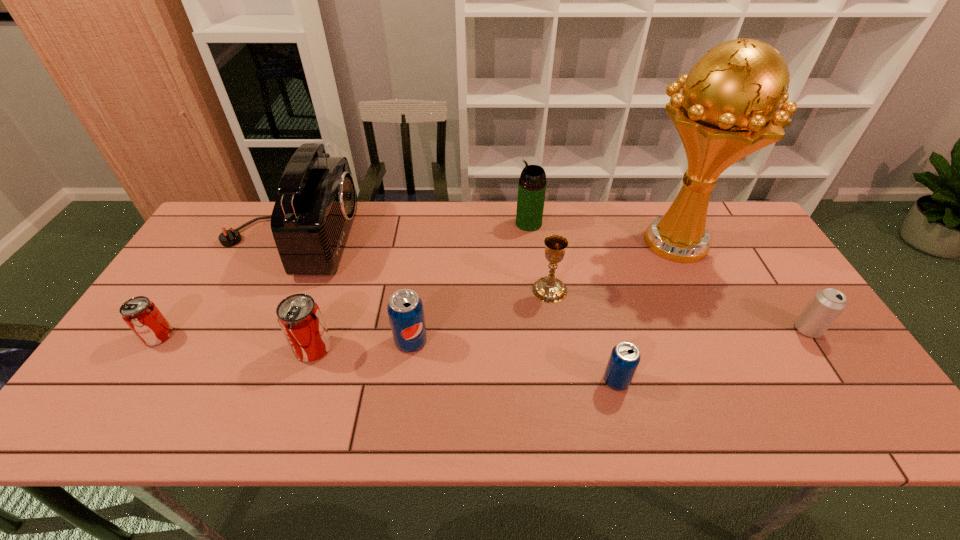
The image size is (960, 540). I want to click on unoccupied position between the chalice and the right red pop soda, so click(431, 319).

The image size is (960, 540). Find the location of `free spot between the green thermos bottle and the radio receiver`. free spot between the green thermos bottle and the radio receiver is located at coordinates (408, 231).

Identify the location of free point between the left blue pop soda and the chalice. (480, 315).

You are a GUI agent. You are given a task and a screenshot of the screen. Output one action in this format:
    pyautogui.click(x=<x>, y=<y>)
    Task: Click on the second closest object to the radio receiver
    This screenshot has width=960, height=540.
    Given the screenshot: What is the action you would take?
    pyautogui.click(x=299, y=317)

Identify which object is located as the fifth nearest to the tallest object. Please provide its 2D coordinates. Your answer should be formatted as a tuple, i.e. [(x, y)], where the tuple contains the x and y coordinates of a point satisfying the conditions above.

[(405, 310)]

Where is `the fourth closest pop soda relative to the chalice`? This screenshot has height=540, width=960. the fourth closest pop soda relative to the chalice is located at coordinates (143, 317).

Locate an element on the screen. the fourth closest pop soda to the radio receiver is located at coordinates (625, 356).

This screenshot has height=540, width=960. Find the location of `vacant space that satisfies the following two spatial constraints: 1. on the back side of the sixth object from right to left; 2. on the front-facing side of the second tallest object`. vacant space that satisfies the following two spatial constraints: 1. on the back side of the sixth object from right to left; 2. on the front-facing side of the second tallest object is located at coordinates (425, 239).

Where is `free space that satisfies the following two spatial constraints: 1. at the front of the gold trophy_cup where the globe is prominent; 2. on the front side of the nearer blue pop soda`? The width and height of the screenshot is (960, 540). free space that satisfies the following two spatial constraints: 1. at the front of the gold trophy_cup where the globe is prominent; 2. on the front side of the nearer blue pop soda is located at coordinates point(738,380).

At what (x,y) coordinates should I click in order to perform the action: click on free location that satisfies the following two spatial constraints: 1. on the back side of the white beer can; 2. on the left side of the bigger red pop soda. Please return your answer as a coordinate pair (x, y). This screenshot has height=540, width=960. Looking at the image, I should click on (320, 329).